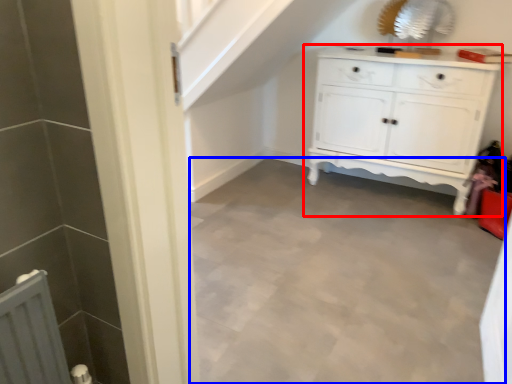
Question: Which object is further to the camera taking this photo, chest of drawers (highlighted by a red box) or plain (highlighted by a blue box)?

Choices:
 (A) chest of drawers
 (B) plain

Answer: (A)